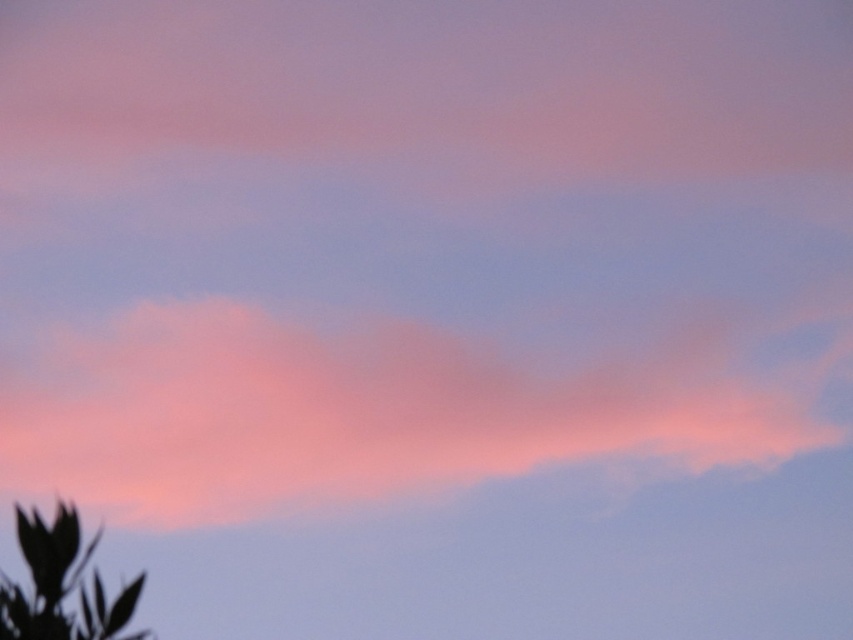
Question: Is pink fluffy cloud at center to the left of silhouette leaf at lower left from the viewer's perspective?

Choices:
 (A) no
 (B) yes

Answer: (A)

Question: Among these points, which one is nearest to the camera?

Choices:
 (A) (432, 438)
 (B) (140, 589)

Answer: (B)

Question: Which object is farther from the camera taking this photo?

Choices:
 (A) silhouette leaf at lower left
 (B) pink fluffy cloud at center

Answer: (B)

Question: Can you confirm if pink fluffy cloud at center is positioned above silhouette leaf at lower left?

Choices:
 (A) yes
 (B) no

Answer: (A)

Question: Can you confirm if pink fluffy cloud at center is bigger than silhouette leaf at lower left?

Choices:
 (A) yes
 (B) no

Answer: (A)